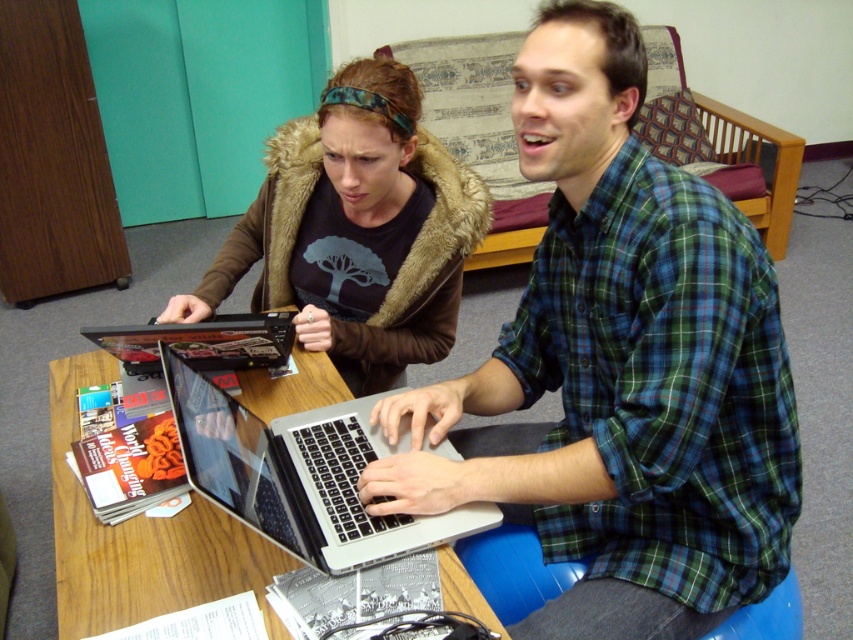
Does green plaid shirt at center appear over brown fur coat at upper left?

Incorrect, green plaid shirt at center is not positioned above brown fur coat at upper left.

Can you confirm if green plaid shirt at center is taller than brown fur coat at upper left?

Yes.

Who is more distant from viewer, (605, 26) or (308, 248)?

Point (308, 248)

I want to click on green plaid shirt at center, so click(x=621, y=369).

Is green plaid shirt at center to the right of wooden table at center from the viewer's perspective?

Yes, green plaid shirt at center is to the right of wooden table at center.

Who is more distant from viewer, (650, 387) or (56, 460)?

Positioned behind is point (56, 460).

What are the coordinates of `green plaid shirt at center` in the screenshot? It's located at (621, 369).

Can you confirm if wooden table at center is smaller than silver metallic laptop at center?

No, wooden table at center is not smaller than silver metallic laptop at center.

Who is more distant from viewer, (200,548) or (277,326)?

Positioned behind is point (277,326).

Locate an element on the screen. This screenshot has width=853, height=640. wooden table at center is located at coordinates (138, 538).